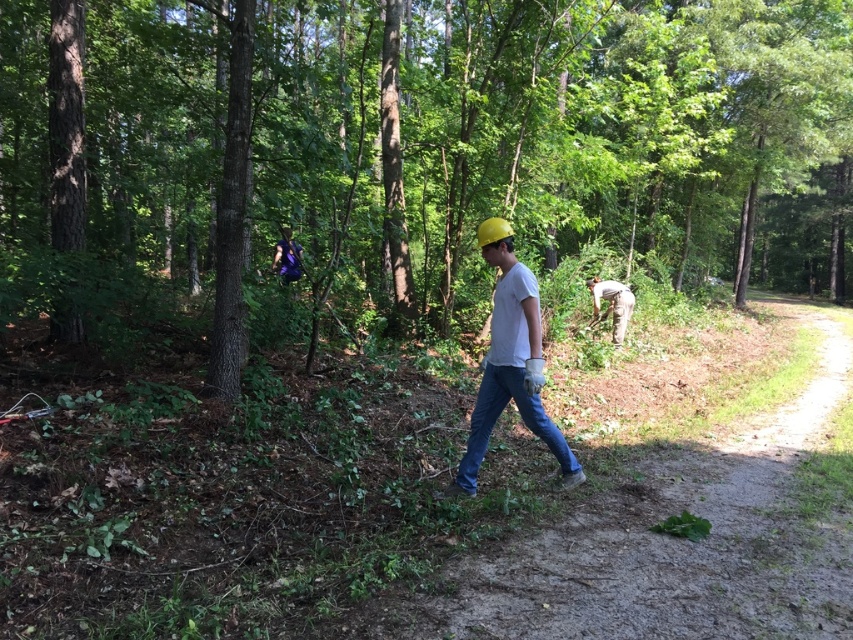
You are a hiker who wants to reach the purple fabric backpack at center from your current position near the white matte shirt at center. Considering the forest terrain, can you estimate how far you need to walk to get there?

The distance between the white matte shirt at center and the purple fabric backpack at center is 18.72 feet, so you need to walk approximately 18.72 feet to reach the backpack.

You are a park ranger observing two workers in the wooded area. You notice both the blue denim jeans at center and the camouflage pants at center. Which worker is closer to you based on their clothing size?

The blue denim jeans at center is smaller than camouflage pants at center, so the worker in blue denim jeans at center is closer to you because smaller size indicates proximity.